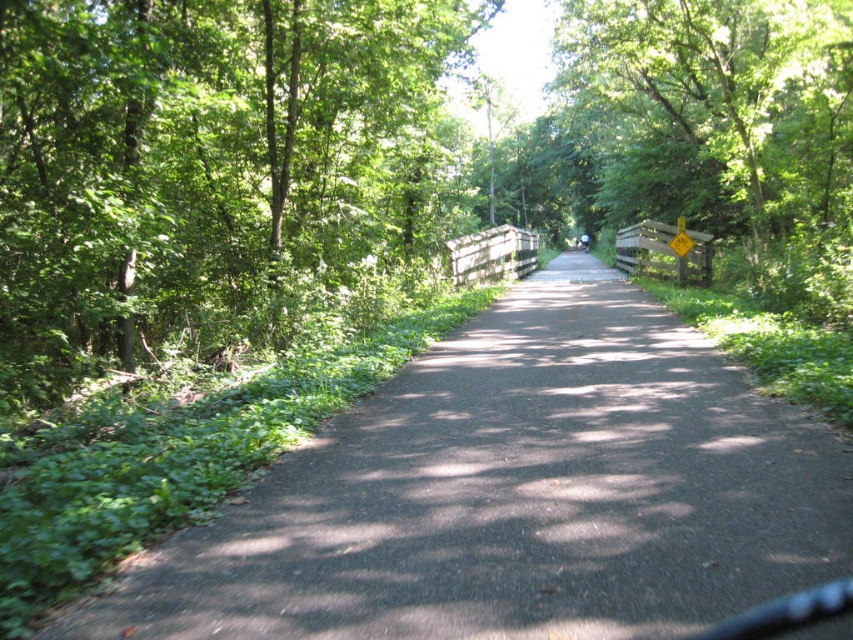
Looking at this image, can you confirm if black asphalt path at center is positioned above green leafy tree at left?

Actually, black asphalt path at center is below green leafy tree at left.

Can you confirm if black asphalt path at center is positioned to the right of green leafy tree at left?

Indeed, black asphalt path at center is positioned on the right side of green leafy tree at left.

What do you see at coordinates (515, 493) in the screenshot? This screenshot has height=640, width=853. I see `black asphalt path at center` at bounding box center [515, 493].

You are a GUI agent. You are given a task and a screenshot of the screen. Output one action in this format:
    pyautogui.click(x=<x>, y=<y>)
    Task: Click on the black asphalt path at center
    The width and height of the screenshot is (853, 640).
    Given the screenshot: What is the action you would take?
    pyautogui.click(x=515, y=493)